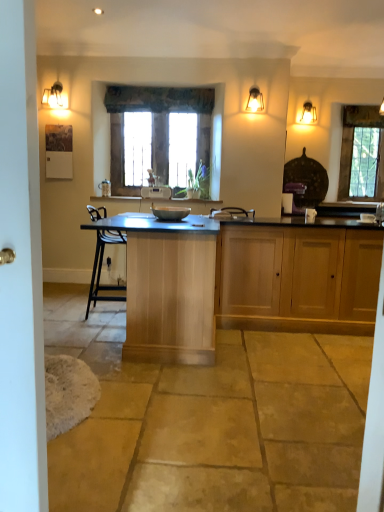
Question: From a real-world perspective, is wooden cabinet at center, arranged as the 1th cabinetry when viewed from the right, above or below satin nickel faucet at right?

Choices:
 (A) above
 (B) below

Answer: (B)

Question: In terms of width, does wooden cabinet at center, the second cabinetry when ordered from left to right, look wider or thinner when compared to satin nickel faucet at right?

Choices:
 (A) wide
 (B) thin

Answer: (A)

Question: Which object is positioned closest to the satin nickel faucet at right?

Choices:
 (A) wooden frame at center, which appears as the 2th window when viewed from the right
 (B) wooden cabinet at center, the second cabinetry when ordered from left to right
 (C) matte glass sconce at upper right, which appears as the first light fixture when viewed from the right
 (D) clear glass window at right, the 2th window in the front-to-back sequence
 (E) matte black bowl at center

Answer: (D)

Question: Considering the real-world distances, which object is farthest from the wooden cabinet at center, the second cabinetry when ordered from left to right?

Choices:
 (A) wooden frame at center, which appears as the 2th window when viewed from the right
 (B) matte brass sconce at upper left, which is the 2th light fixture from back to front
 (C) light wood cabinet at center, the 1th cabinetry when ordered from left to right
 (D) matte brass light fixture at upper right, arranged as the third light fixture when viewed from the back
 (E) matte black bowl at center

Answer: (B)